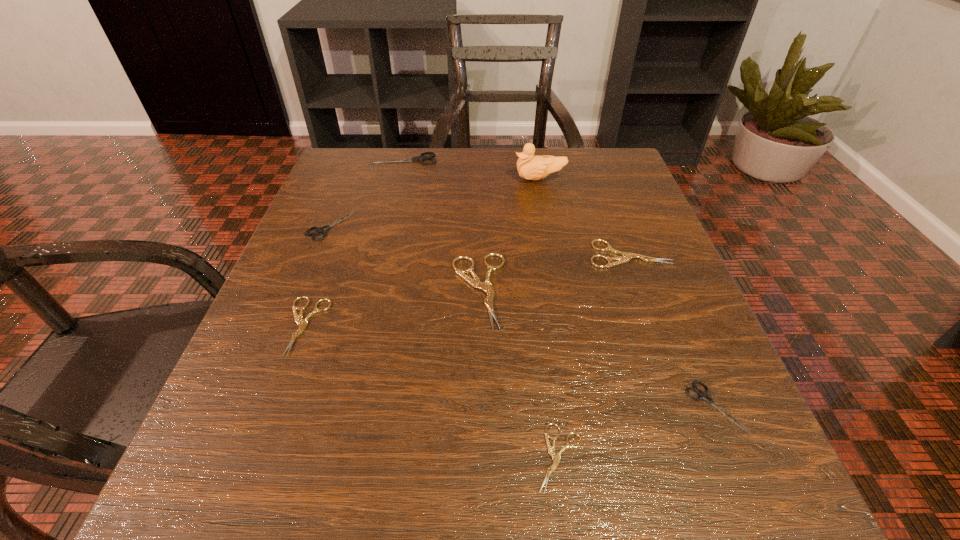
This screenshot has width=960, height=540. Identify the location of vacant area at the left edge. (345, 259).

Identify the location of vacant point at the right edge. The width and height of the screenshot is (960, 540). (651, 295).

Identify the location of free space at the far left corner. (315, 197).

Find the location of a particular element. This screenshot has height=540, width=960. vacant space at the far right corner of the desktop is located at coordinates (597, 203).

In the image, there is a desktop. Where is `blank space at the near right corner`? blank space at the near right corner is located at coordinates (660, 507).

This screenshot has height=540, width=960. What are the coordinates of `vacant area that lies between the farthest black shears and the tallest object` in the screenshot? It's located at (472, 169).

Where is `vacant area that lies between the leftmost beige shears and the rightmost black shears`? Image resolution: width=960 pixels, height=540 pixels. vacant area that lies between the leftmost beige shears and the rightmost black shears is located at coordinates (510, 366).

The image size is (960, 540). I want to click on vacant area that lies between the shortest object and the second smallest black shears, so click(x=446, y=341).

Locate an element on the screen. The image size is (960, 540). free spot between the rightmost beige shears and the second nearest black shears is located at coordinates (480, 239).

The height and width of the screenshot is (540, 960). In order to click on empty space that is in between the farthest black shears and the leftmost beige shears in this screenshot , I will do 355,242.